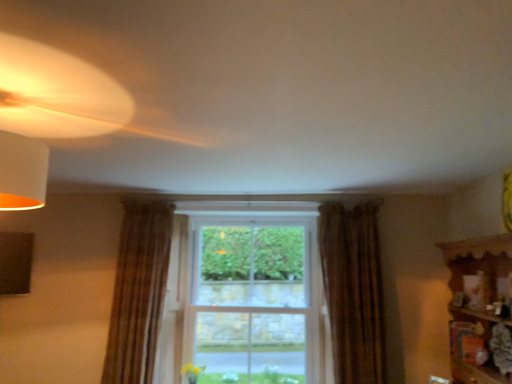
Question: Can you confirm if brown textured curtain at left, which ranks as the first curtain in left-to-right order, is positioned to the right of wooden shelf at right?

Choices:
 (A) yes
 (B) no

Answer: (B)

Question: Is brown textured curtain at left, which appears as the second curtain when viewed from the right, turned away from wooden shelf at right?

Choices:
 (A) yes
 (B) no

Answer: (B)

Question: Can wooden shelf at right be found inside brown textured curtain at left, which appears as the second curtain when viewed from the right?

Choices:
 (A) no
 (B) yes

Answer: (A)

Question: From the image's perspective, would you say brown textured curtain at left, which appears as the second curtain when viewed from the right, is shown under wooden shelf at right?

Choices:
 (A) no
 (B) yes

Answer: (B)

Question: Does brown textured curtain at left, which appears as the second curtain when viewed from the right, have a lesser height compared to wooden shelf at right?

Choices:
 (A) no
 (B) yes

Answer: (A)

Question: Based on their positions, is brown textured curtain at left, which appears as the second curtain when viewed from the right, located to the left or right of clear glass window at center?

Choices:
 (A) right
 (B) left

Answer: (B)

Question: Is point (137, 205) closer or farther from the camera than point (284, 332)?

Choices:
 (A) closer
 (B) farther

Answer: (A)

Question: Considering the positions of brown textured curtain at left, which ranks as the first curtain in left-to-right order, and clear glass window at center in the image, is brown textured curtain at left, which ranks as the first curtain in left-to-right order, taller or shorter than clear glass window at center?

Choices:
 (A) tall
 (B) short

Answer: (B)

Question: From the image's perspective, is brown textured curtain at left, which appears as the second curtain when viewed from the right, located above or below clear glass window at center?

Choices:
 (A) below
 (B) above

Answer: (B)

Question: In the image, is brown textured curtain at left, which appears as the second curtain when viewed from the right, on the left side or the right side of brown textured curtain at right, the 1th curtain viewed from the right?

Choices:
 (A) left
 (B) right

Answer: (A)

Question: Relative to brown textured curtain at right, which ranks as the 2th curtain in left-to-right order, is brown textured curtain at left, which ranks as the first curtain in left-to-right order, in front or behind?

Choices:
 (A) front
 (B) behind

Answer: (B)

Question: Looking at the image, does brown textured curtain at left, which appears as the second curtain when viewed from the right, seem bigger or smaller compared to brown textured curtain at right, the 1th curtain viewed from the right?

Choices:
 (A) small
 (B) big

Answer: (A)

Question: Is point pyautogui.click(x=163, y=223) closer or farther from the camera than point pyautogui.click(x=323, y=264)?

Choices:
 (A) closer
 (B) farther

Answer: (B)

Question: From a real-world perspective, is brown textured curtain at right, the 1th curtain viewed from the right, positioned above or below wooden shelf at right?

Choices:
 (A) above
 (B) below

Answer: (A)

Question: In the image, is brown textured curtain at right, which ranks as the 2th curtain in left-to-right order, on the left side or the right side of wooden shelf at right?

Choices:
 (A) right
 (B) left

Answer: (B)